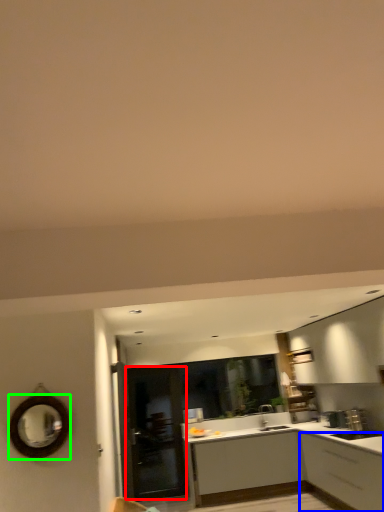
Question: Which object is positioned farthest from glass door (highlighted by a red box)? Select from cabinetry (highlighted by a blue box) and mirror (highlighted by a green box).

Choices:
 (A) cabinetry
 (B) mirror

Answer: (B)